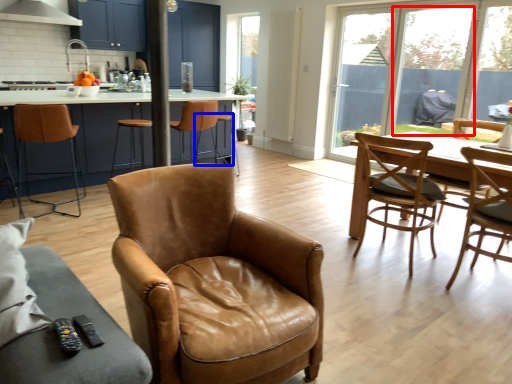
Question: Among these objects, which one is nearest to the camera, window screen (highlighted by a red box) or bar stool (highlighted by a blue box)?

Choices:
 (A) window screen
 (B) bar stool

Answer: (A)